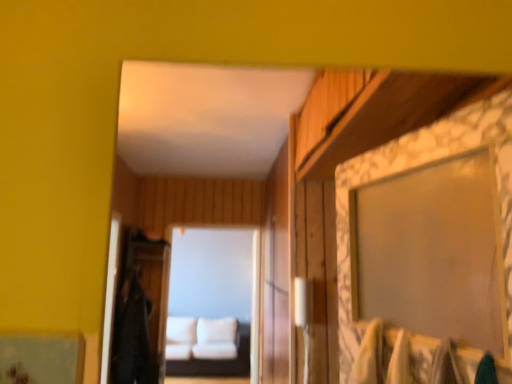
Locate an element on the screen. The width and height of the screenshot is (512, 384). free point above white fabric couch at center (from a real-world perspective) is located at coordinates (201, 223).